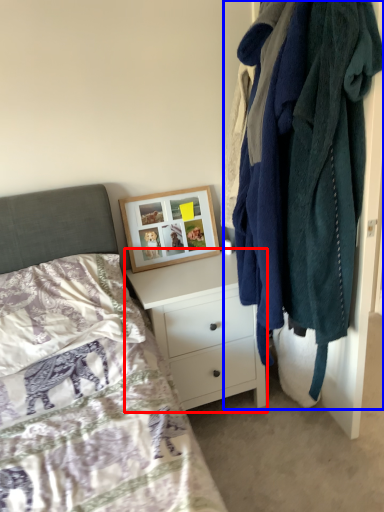
Question: Which of the following is the closest to the observer, chest of drawers (highlighted by a red box) or closet (highlighted by a blue box)?

Choices:
 (A) chest of drawers
 (B) closet

Answer: (B)